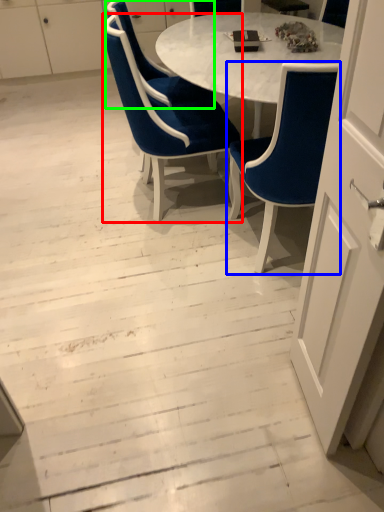
Question: Which object is positioned farthest from chair (highlighted by a red box)? Select from chair (highlighted by a blue box) and chair (highlighted by a green box).

Choices:
 (A) chair
 (B) chair

Answer: (A)